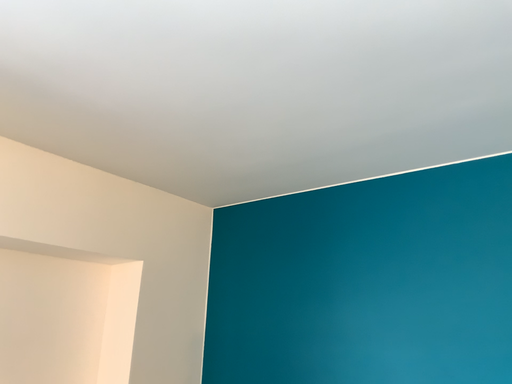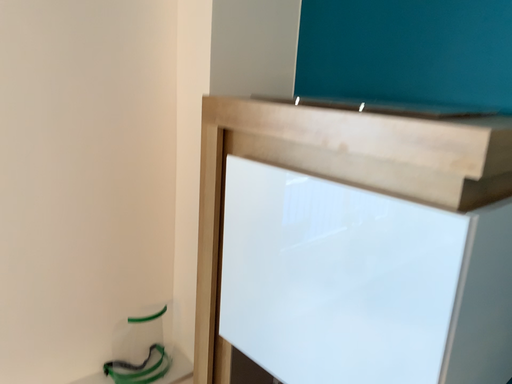
Question: How did the camera likely rotate when shooting the video?

Choices:
 (A) rotated upward
 (B) rotated downward

Answer: (B)